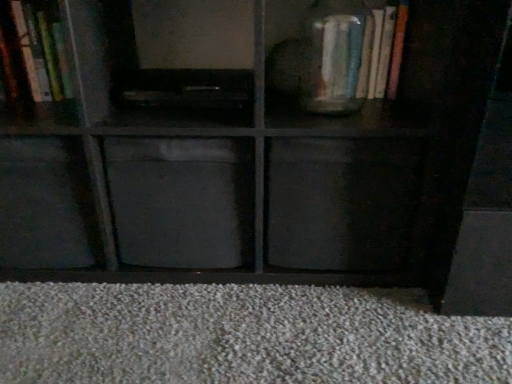
Where is `matte glass vase at upper right`? matte glass vase at upper right is located at coordinates (352, 55).

Where is `black matte drawer at center`? The height and width of the screenshot is (384, 512). black matte drawer at center is located at coordinates (341, 202).

How much space does wooden bookshelf at upper left, acting as the first cabinet starting from the left, occupy vertically?

The height of wooden bookshelf at upper left, acting as the first cabinet starting from the left, is 23.71 centimeters.

You are a GUI agent. You are given a task and a screenshot of the screen. Output one action in this format:
    pyautogui.click(x=<x>, y=<y>)
    Task: Click on the matte glass vase at upper right
    Image resolution: width=512 pixels, height=384 pixels.
    Given the screenshot: What is the action you would take?
    pyautogui.click(x=352, y=55)

From a real-world perspective, is matte gray cabinet at center, which is the third cabinet in left-to-right order, above or below black matte drawer at center?

matte gray cabinet at center, which is the third cabinet in left-to-right order, is above black matte drawer at center.

Can you tell me how much matte gray cabinet at center, positioned as the first cabinet in right-to-left order, and black matte drawer at center differ in facing direction?

matte gray cabinet at center, positioned as the first cabinet in right-to-left order, and black matte drawer at center are facing 4.43e-05 degrees away from each other.

Is matte gray cabinet at center, which is the third cabinet in left-to-right order, wider than black matte drawer at center?

No.

Between matte gray cabinet at center, which is the third cabinet in left-to-right order, and black matte drawer at center, which one appears on the right side from the viewer's perspective?

Positioned to the right is black matte drawer at center.

Which of these two, matte gray cabinet at center, positioned as the first cabinet in right-to-left order, or matte glass vase at upper right, is smaller?

matte glass vase at upper right is smaller.

From a real-world perspective, is matte gray cabinet at center, which is the third cabinet in left-to-right order, located higher than matte glass vase at upper right?

Incorrect, from a real-world perspective, matte gray cabinet at center, which is the third cabinet in left-to-right order, is lower than matte glass vase at upper right.

From the image's perspective, does matte gray cabinet at center, which is the third cabinet in left-to-right order, appear lower than matte glass vase at upper right?

Indeed, from the image's perspective, matte gray cabinet at center, which is the third cabinet in left-to-right order, is shown beneath matte glass vase at upper right.

Considering the relative sizes of matte gray cabinet at center, which is the third cabinet in left-to-right order, and matte glass vase at upper right in the image provided, is matte gray cabinet at center, which is the third cabinet in left-to-right order, taller than matte glass vase at upper right?

Indeed, matte gray cabinet at center, which is the third cabinet in left-to-right order, has a greater height compared to matte glass vase at upper right.

Looking at their sizes, would you say matte glass vase at upper right is wider or thinner than matte gray cabinet at center, which is the third cabinet in left-to-right order?

matte glass vase at upper right is thinner than matte gray cabinet at center, which is the third cabinet in left-to-right order.

Considering the sizes of objects matte glass vase at upper right and matte gray cabinet at center, positioned as the first cabinet in right-to-left order, in the image provided, who is smaller, matte glass vase at upper right or matte gray cabinet at center, positioned as the first cabinet in right-to-left order,?

matte glass vase at upper right.

The height and width of the screenshot is (384, 512). I want to click on the 2nd cabinet positioned below the matte glass vase at upper right (from the image's perspective), so click(x=182, y=201).

Is the surface of matte glass vase at upper right in direct contact with matte gray cabinet at center, which is the third cabinet in left-to-right order?

No, matte glass vase at upper right is not in contact with matte gray cabinet at center, which is the third cabinet in left-to-right order.

Considering the relative sizes of matte black cube at lower left, marked as the 2th cabinet in a left-to-right arrangement, and wooden bookshelf at upper left, acting as the 3th cabinet starting from the right, in the image provided, is matte black cube at lower left, marked as the 2th cabinet in a left-to-right arrangement, wider than wooden bookshelf at upper left, acting as the 3th cabinet starting from the right,?

Yes, matte black cube at lower left, marked as the 2th cabinet in a left-to-right arrangement, is wider than wooden bookshelf at upper left, acting as the 3th cabinet starting from the right.

Does point (79, 176) come behind point (61, 16)?

No, (79, 176) is in front of (61, 16).

Does matte black cube at lower left, positioned as the second cabinet in right-to-left order, appear on the right side of wooden bookshelf at upper left, acting as the first cabinet starting from the left?

Yes, matte black cube at lower left, positioned as the second cabinet in right-to-left order, is to the right of wooden bookshelf at upper left, acting as the first cabinet starting from the left.

Is matte black cube at lower left, marked as the 2th cabinet in a left-to-right arrangement, touching matte glass vase at upper right?

matte black cube at lower left, marked as the 2th cabinet in a left-to-right arrangement, and matte glass vase at upper right are clearly separated.

Based on the photo, is matte black cube at lower left, positioned as the second cabinet in right-to-left order, positioned behind matte glass vase at upper right?

No, matte black cube at lower left, positioned as the second cabinet in right-to-left order, is closer to the viewer.

Does point (71, 216) come closer to viewer compared to point (314, 97)?

Yes, it is.

How distant is black matte drawer at center from wooden bookshelf at upper left, acting as the first cabinet starting from the left?

A distance of 22.31 inches exists between black matte drawer at center and wooden bookshelf at upper left, acting as the first cabinet starting from the left.

Considering the sizes of objects black matte drawer at center and wooden bookshelf at upper left, acting as the first cabinet starting from the left, in the image provided, who is shorter, black matte drawer at center or wooden bookshelf at upper left, acting as the first cabinet starting from the left,?

Standing shorter between the two is wooden bookshelf at upper left, acting as the first cabinet starting from the left.

Which object is wider, black matte drawer at center or wooden bookshelf at upper left, acting as the 3th cabinet starting from the right?

Wider between the two is black matte drawer at center.

Is matte glass vase at upper right positioned far away from matte black cube at lower left, positioned as the second cabinet in right-to-left order?

No, matte glass vase at upper right is not far away from matte black cube at lower left, positioned as the second cabinet in right-to-left order.

Is matte glass vase at upper right shorter than matte black cube at lower left, positioned as the second cabinet in right-to-left order?

Yes, matte glass vase at upper right is shorter than matte black cube at lower left, positioned as the second cabinet in right-to-left order.

At what (x,y) coordinates should I click in order to perform the action: click on cabinet that is the 2nd object located in front of the matte glass vase at upper right. Please return your answer as a coordinate pair (x, y). The image size is (512, 384). Looking at the image, I should click on (46, 205).

Looking at this image, does matte glass vase at upper right appear on the left side of matte black cube at lower left, marked as the 2th cabinet in a left-to-right arrangement?

No, matte glass vase at upper right is not to the left of matte black cube at lower left, marked as the 2th cabinet in a left-to-right arrangement.

You are a GUI agent. You are given a task and a screenshot of the screen. Output one action in this format:
    pyautogui.click(x=<x>, y=<y>)
    Task: Click on the 1st cabinet to the left of the black matte drawer at center, counting from the anchor's position
    This screenshot has height=384, width=512.
    Given the screenshot: What is the action you would take?
    pyautogui.click(x=182, y=201)

Image resolution: width=512 pixels, height=384 pixels. Find the location of `the 3rd cabinet in front when counting from the matte glass vase at upper right`. the 3rd cabinet in front when counting from the matte glass vase at upper right is located at coordinates (182, 201).

Based on their spatial positions, is matte gray cabinet at center, positioned as the first cabinet in right-to-left order, or wooden bookshelf at upper left, acting as the first cabinet starting from the left, closer to black matte drawer at center?

Among the two, matte gray cabinet at center, positioned as the first cabinet in right-to-left order, is located nearer to black matte drawer at center.

Considering their positions, is matte gray cabinet at center, positioned as the first cabinet in right-to-left order, positioned further to black matte drawer at center than matte black cube at lower left, marked as the 2th cabinet in a left-to-right arrangement?

matte black cube at lower left, marked as the 2th cabinet in a left-to-right arrangement, lies further to black matte drawer at center than the other object.

Considering their positions, is black matte drawer at center positioned closer to matte gray cabinet at center, which is the third cabinet in left-to-right order, than matte black cube at lower left, marked as the 2th cabinet in a left-to-right arrangement?

matte black cube at lower left, marked as the 2th cabinet in a left-to-right arrangement, is closer to matte gray cabinet at center, which is the third cabinet in left-to-right order.

Estimate the real-world distances between objects in this image. Which object is further from matte gray cabinet at center, which is the third cabinet in left-to-right order, matte black cube at lower left, marked as the 2th cabinet in a left-to-right arrangement, or black matte drawer at center?

black matte drawer at center lies further to matte gray cabinet at center, which is the third cabinet in left-to-right order, than the other object.

Based on their spatial positions, is matte glass vase at upper right or black matte drawer at center further from wooden bookshelf at upper left, acting as the first cabinet starting from the left?

matte glass vase at upper right is positioned further to the anchor wooden bookshelf at upper left, acting as the first cabinet starting from the left.

When comparing their distances from wooden bookshelf at upper left, acting as the 3th cabinet starting from the right, does matte gray cabinet at center, which is the third cabinet in left-to-right order, or matte glass vase at upper right seem further?

Based on the image, matte glass vase at upper right appears to be further to wooden bookshelf at upper left, acting as the 3th cabinet starting from the right.

From the image, which object appears to be nearer to black matte drawer at center, wooden bookshelf at upper left, acting as the 3th cabinet starting from the right, or matte gray cabinet at center, positioned as the first cabinet in right-to-left order?

matte gray cabinet at center, positioned as the first cabinet in right-to-left order, is positioned closer to the anchor black matte drawer at center.

From the image, which object appears to be nearer to matte gray cabinet at center, which is the third cabinet in left-to-right order, matte glass vase at upper right or black matte drawer at center?

black matte drawer at center is closer to matte gray cabinet at center, which is the third cabinet in left-to-right order.

Locate an element on the screen. drawer situated between matte gray cabinet at center, which is the third cabinet in left-to-right order, and matte glass vase at upper right from left to right is located at coordinates tap(341, 202).

The image size is (512, 384). Find the location of `cabinet located between matte black cube at lower left, marked as the 2th cabinet in a left-to-right arrangement, and black matte drawer at center in the left-right direction`. cabinet located between matte black cube at lower left, marked as the 2th cabinet in a left-to-right arrangement, and black matte drawer at center in the left-right direction is located at coordinates (182, 201).

Identify the location of cabinet located between matte black cube at lower left, marked as the 2th cabinet in a left-to-right arrangement, and matte glass vase at upper right in the left-right direction. (182, 201).

This screenshot has width=512, height=384. I want to click on cabinet situated between wooden bookshelf at upper left, acting as the 3th cabinet starting from the right, and matte gray cabinet at center, positioned as the first cabinet in right-to-left order, from left to right, so click(x=46, y=205).